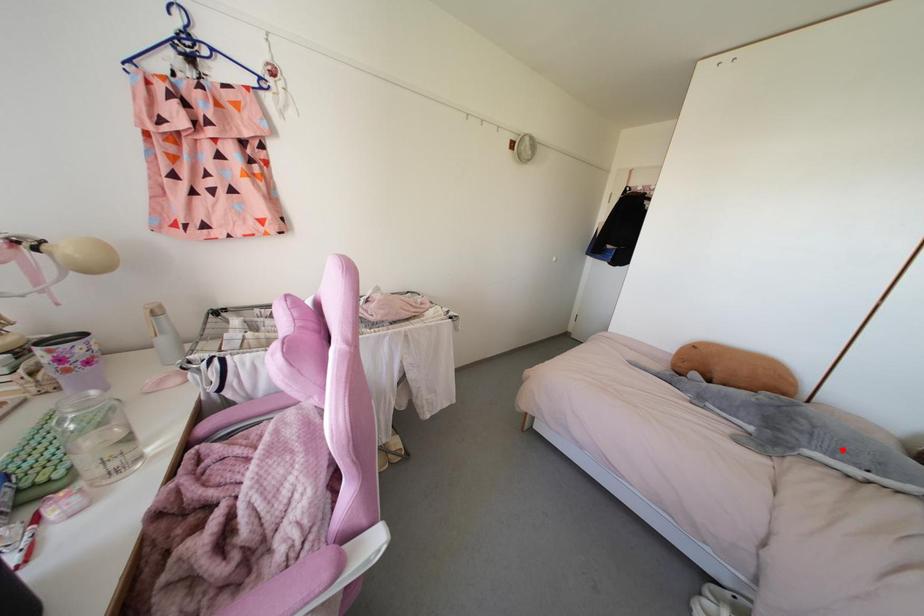
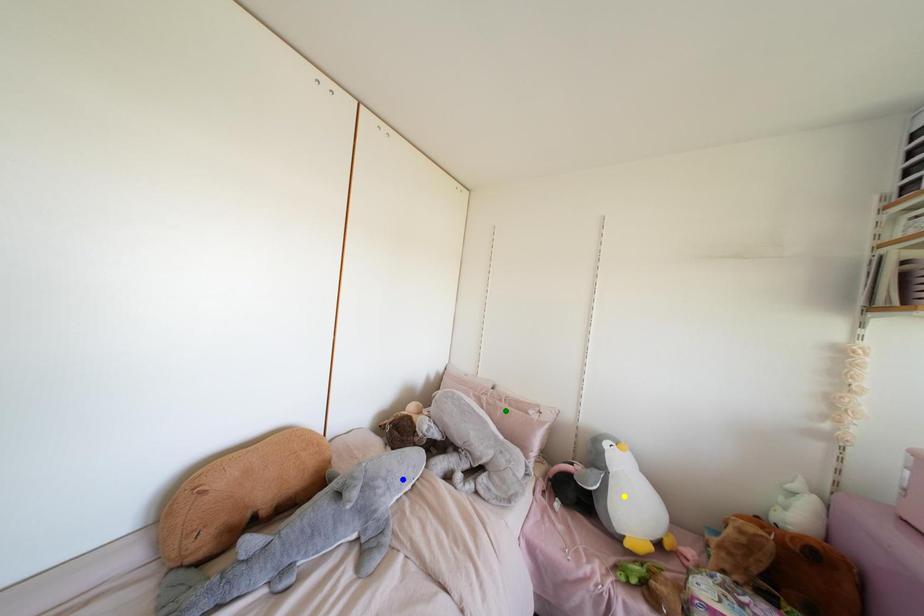
Question: I am providing you with two images of the same scene from different viewpoints. A red point is marked on the first image. You are given multiple points on the second image. Can you choose the point in image 2 that corresponds to the point in image 1?

Choices:
 (A) yellow point
 (B) green point
 (C) blue point

Answer: (C)